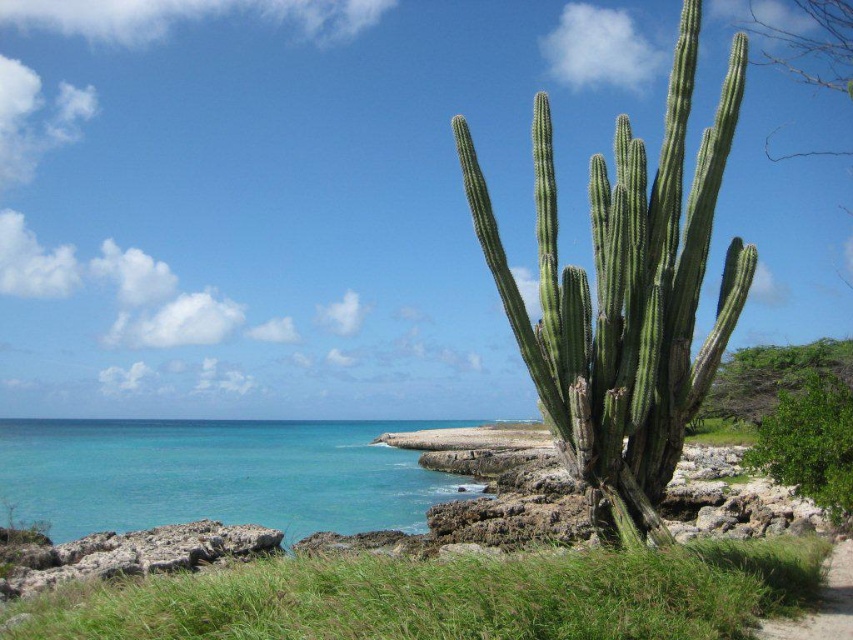
From the picture: Is green succulent cactus at right closer to the viewer compared to turquoise water at lower left?

Yes, it is.

Between green succulent cactus at right and turquoise water at lower left, which one appears on the right side from the viewer's perspective?

green succulent cactus at right

I want to click on green succulent cactus at right, so click(625, 298).

This screenshot has width=853, height=640. Find the location of `green succulent cactus at right`. green succulent cactus at right is located at coordinates (625, 298).

Who is positioned more to the right, green succulent cactus at right or dirt path at lower right?

Positioned to the right is dirt path at lower right.

Who is taller, green succulent cactus at right or dirt path at lower right?

green succulent cactus at right

From the picture: Who is more forward, (624, 296) or (836, 609)?

Point (836, 609)

You are a GUI agent. You are given a task and a screenshot of the screen. Output one action in this format:
    pyautogui.click(x=<x>, y=<y>)
    Task: Click on the green succulent cactus at right
    
    Given the screenshot: What is the action you would take?
    pyautogui.click(x=625, y=298)

Does turquoise water at lower left appear on the left side of dirt path at lower right?

Correct, you'll find turquoise water at lower left to the left of dirt path at lower right.

Does turquoise water at lower left have a larger size compared to dirt path at lower right?

Indeed, turquoise water at lower left has a larger size compared to dirt path at lower right.

Which is behind, point (363, 465) or point (802, 618)?

The point (363, 465) is more distant.

At what (x,y) coordinates should I click in order to perform the action: click on turquoise water at lower left. Please return your answer as a coordinate pair (x, y). Looking at the image, I should click on (215, 476).